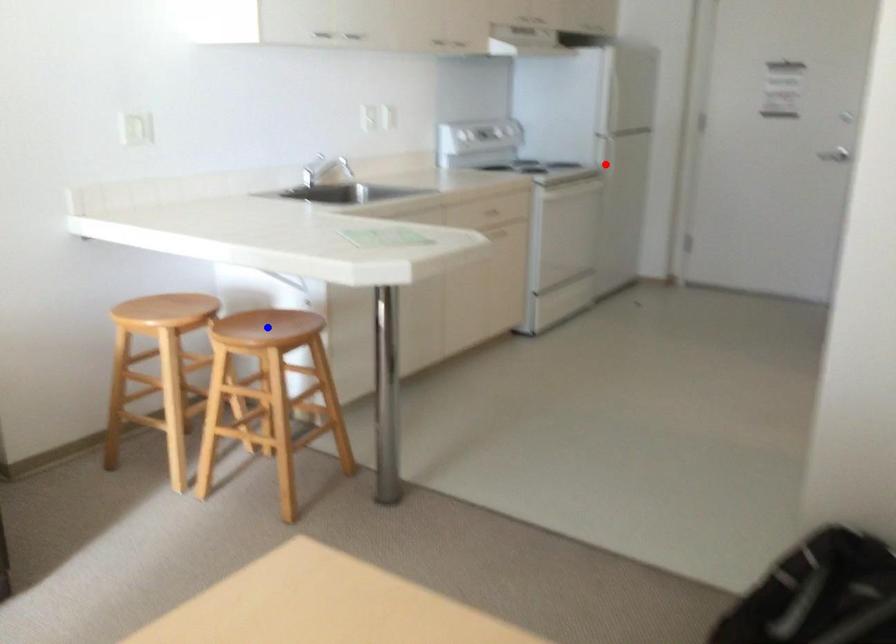
Question: Two points are marked on the image. Which point is closer to the camera?

Choices:
 (A) Blue point is closer.
 (B) Red point is closer.

Answer: (A)